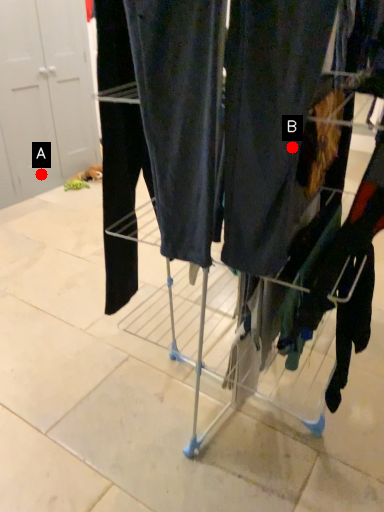
Question: Two points are circled on the image, labeled by A and B beside each circle. Which point is closer to the camera taking this photo?

Choices:
 (A) A is closer
 (B) B is closer

Answer: (B)